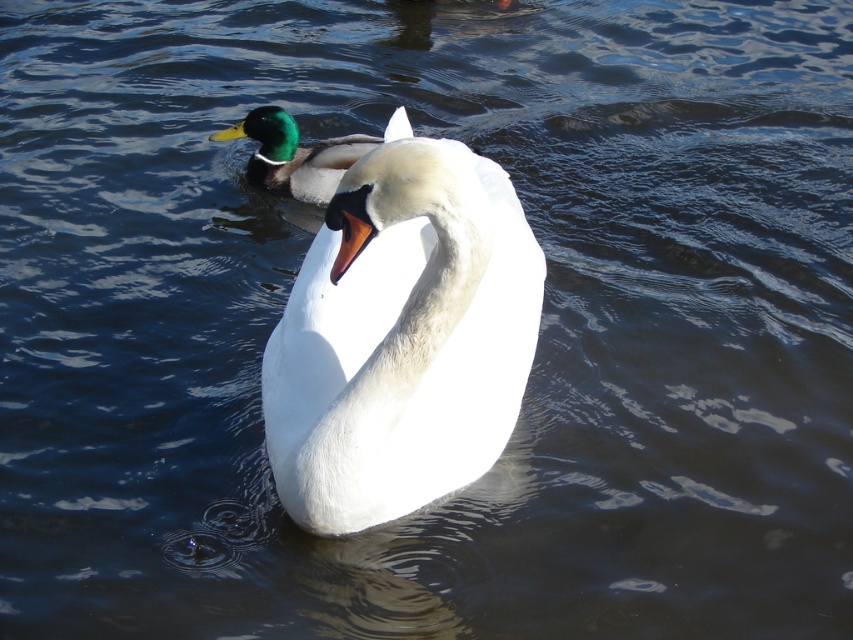
You are a wildlife photographer trying to capture a photo of both the white glossy swan at center and the green glossy duck at upper left. Since you want to include both in the frame, which bird should you focus on to ensure both are in focus?

You should focus on the white glossy swan at center because it is larger and closer to the camera than the green glossy duck at upper left, ensuring both are in focus.

You are a photographer trying to capture a clear shot of both the white glossy swan at center and the green glossy duck at upper left. Since you want to ensure both are visible, which bird should you focus on first to account for their sizes?

The white glossy swan at center is taller than the green glossy duck at upper left, so you should focus on the white glossy swan at center first to ensure its full height is captured before adjusting for the smaller duck.

You are a photographer trying to capture both birds in the image. You notice two points marked on your screen at coordinates point (x=392, y=508) and point (x=364, y=144). Which point is closer to the camera?

Point (x=392, y=508) is in front of point (x=364, y=144), so it is closer to the camera.